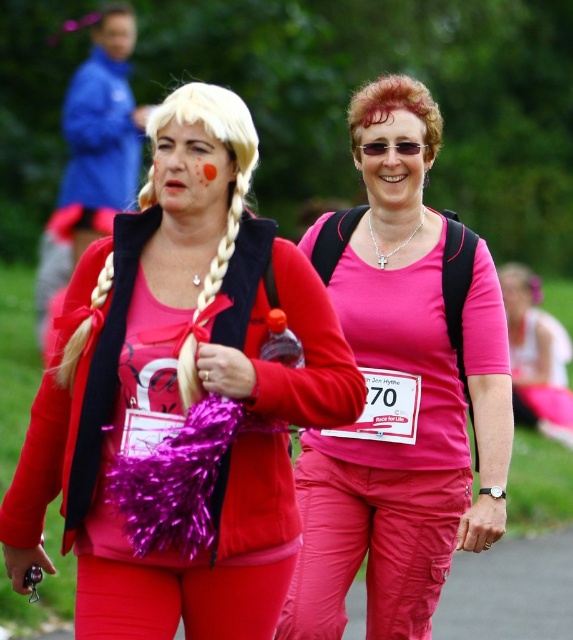
You are a photographer standing at the starting line of a race. You see the pink matte shirt at center and a camera. How far apart are they?

The pink matte shirt at center and the camera are 23.37 feet apart.

Consider the image. You are a judge in a costume contest. You see the matte plastic face at center and the smooth skin face at upper left. Which face is located below the other?

The matte plastic face at center is positioned under the smooth skin face at upper left.

You are a judge in a costume contest. You must decide which face looks more realistic. Based on the scene, which face is closer to the judge? The options are the matte plastic face at center and the smooth skin face at upper left.

The matte plastic face at center is in front of the smooth skin face at upper left, so the matte plastic face at center is closer to the judge and would appear more realistic due to its proximity.